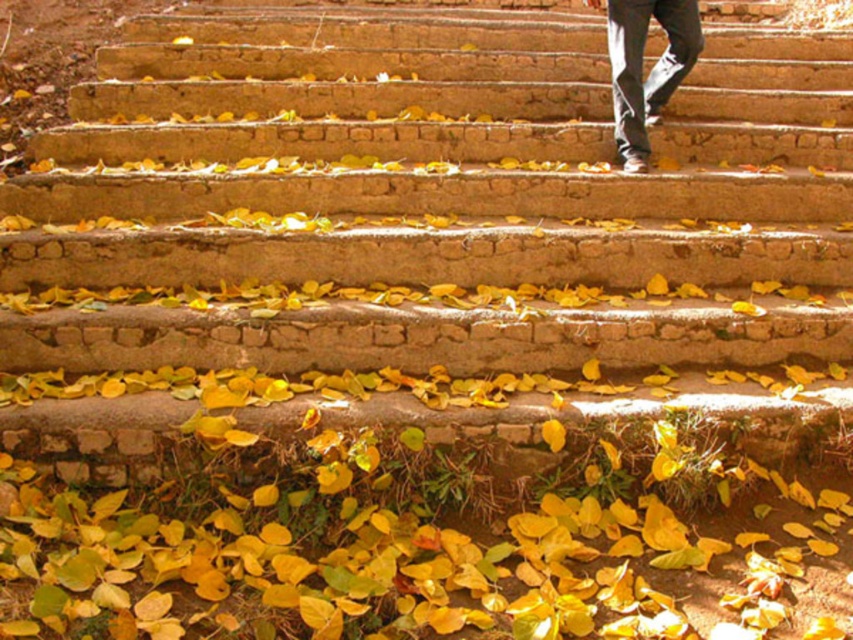
Between point (212, 476) and point (671, 36), which one is positioned in front?

Point (212, 476) is in front.

Can you confirm if yellow matte leaves at bottom is bigger than dark gray jeans at upper center?

Correct, yellow matte leaves at bottom is larger in size than dark gray jeans at upper center.

Locate an element on the screen. Image resolution: width=853 pixels, height=640 pixels. yellow matte leaves at bottom is located at coordinates (393, 557).